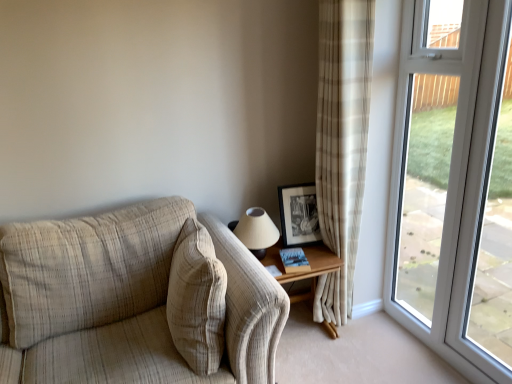
Where is `free space in front of wooden table at right`? The image size is (512, 384). free space in front of wooden table at right is located at coordinates (325, 365).